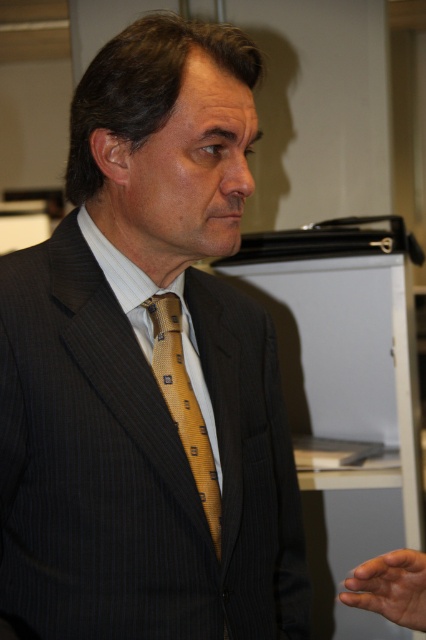
Describe the element at coordinates (167, 362) in the screenshot. I see `white silk dress shirt at center` at that location.

Is white silk dress shirt at center taller than gold woven tie at center?

Indeed, white silk dress shirt at center has a greater height compared to gold woven tie at center.

Is point (149, 333) behind point (166, 371)?

Yes, it is.

Where is `white silk dress shirt at center`? Image resolution: width=426 pixels, height=640 pixels. white silk dress shirt at center is located at coordinates (167, 362).

Measure the distance between pinstriped suit at center and camera.

A distance of 31.71 inches exists between pinstriped suit at center and camera.

Does pinstriped suit at center lie behind white silk dress shirt at center?

That is False.

Image resolution: width=426 pixels, height=640 pixels. Identify the location of pinstriped suit at center. (147, 371).

Can you confirm if pinstriped suit at center is bigger than gold woven tie at center?

Indeed, pinstriped suit at center has a larger size compared to gold woven tie at center.

Is point (181, 346) in front of point (187, 406)?

No.

Locate an element on the screen. The height and width of the screenshot is (640, 426). pinstriped suit at center is located at coordinates (147, 371).